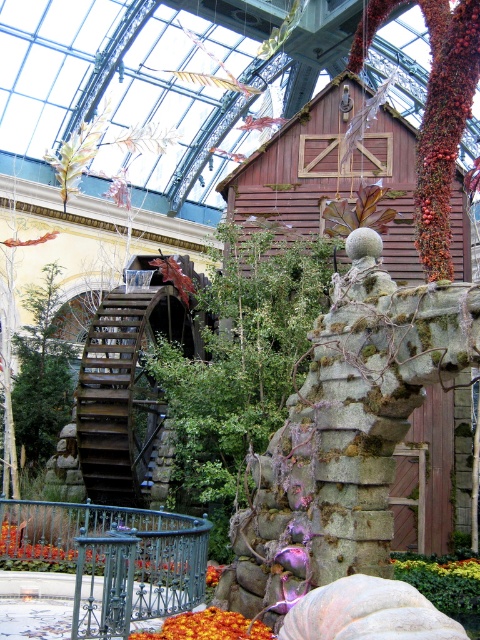
Can you confirm if green leafy plant at center is positioned above orange matte flower at lower center?

Actually, green leafy plant at center is below orange matte flower at lower center.

Locate an element on the screen. green leafy plant at center is located at coordinates (444, 582).